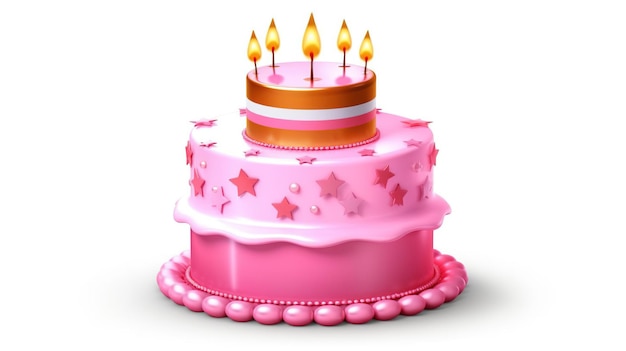
Find the location of `candles`. candles is located at coordinates (365, 68), (342, 58), (312, 69), (273, 60), (255, 67).